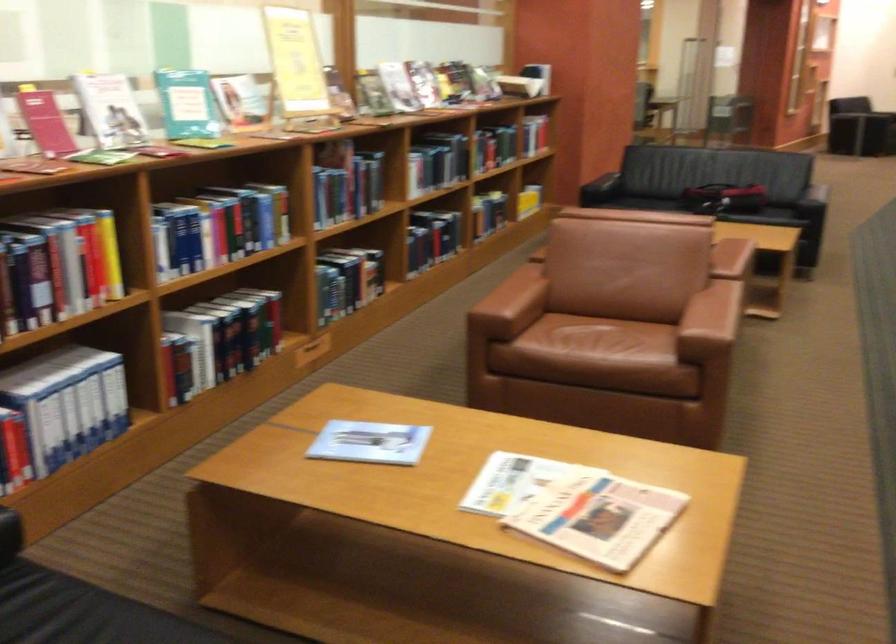
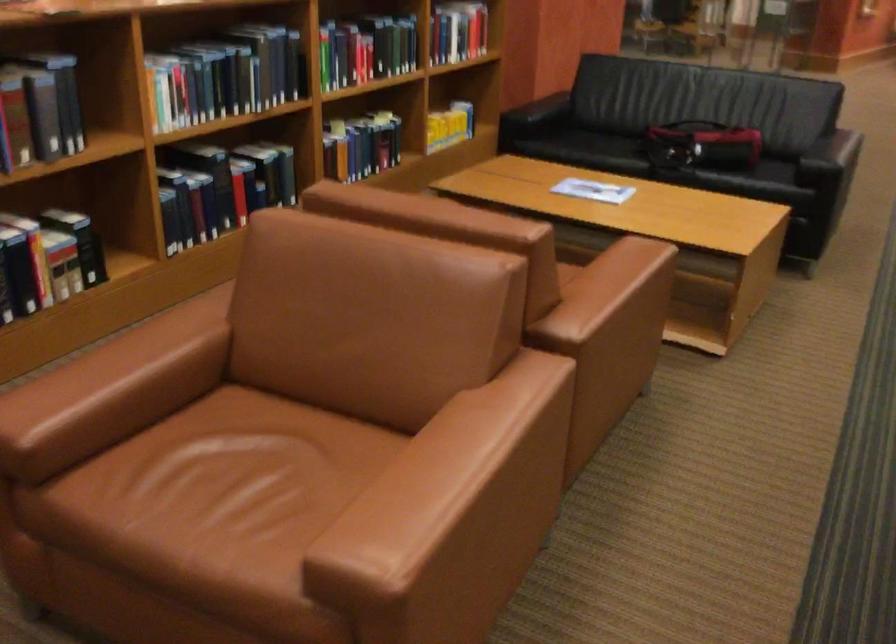
In a continuous first-person perspective shot, in which direction is the camera moving?

The movement direction of the cameraman is right, forward.